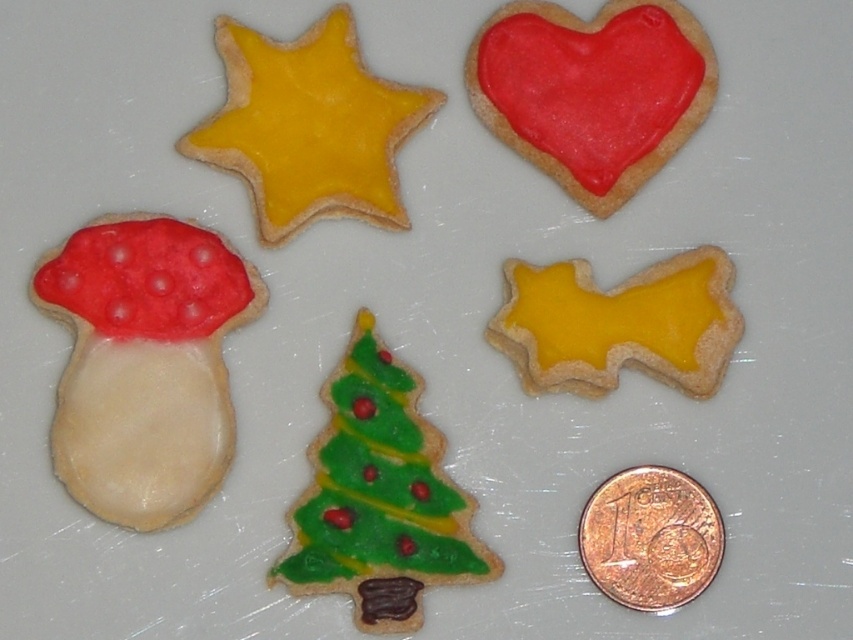
Consider the image. Who is lower down, matte white mushroom at left or green matte christmas tree at center?

green matte christmas tree at center is lower down.

In the scene shown: Is matte white mushroom at left further to the viewer compared to green matte christmas tree at center?

That is True.

At what (x,y) coordinates should I click in order to perform the action: click on matte white mushroom at left. Please return your answer as a coordinate pair (x, y). Image resolution: width=853 pixels, height=640 pixels. Looking at the image, I should click on (144, 364).

Between matte white mushroom at left and yellow matte star at upper left, which one is positioned higher?

yellow matte star at upper left is above.

You are a GUI agent. You are given a task and a screenshot of the screen. Output one action in this format:
    pyautogui.click(x=<x>, y=<y>)
    Task: Click on the matte white mushroom at left
    
    Given the screenshot: What is the action you would take?
    pyautogui.click(x=144, y=364)

Find the location of a particular element. The height and width of the screenshot is (640, 853). red glossy heart at upper right is located at coordinates (593, 90).

What do you see at coordinates (593, 90) in the screenshot? The width and height of the screenshot is (853, 640). I see `red glossy heart at upper right` at bounding box center [593, 90].

At what (x,y) coordinates should I click in order to perform the action: click on red glossy heart at upper right. Please return your answer as a coordinate pair (x, y). This screenshot has height=640, width=853. Looking at the image, I should click on (593, 90).